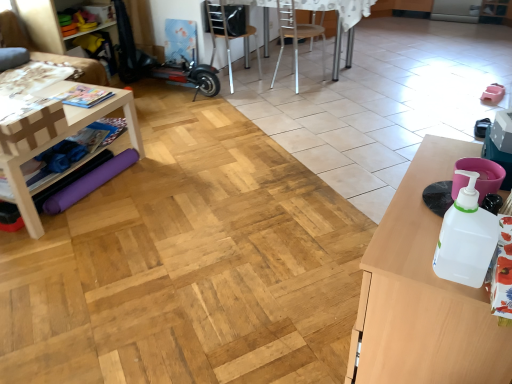
You are a GUI agent. You are given a task and a screenshot of the screen. Output one action in this format:
    pyautogui.click(x=<x>, y=<y>)
    Task: Click on the free space behind wooden table at right, which is the 2th table in left-to-right order
    The width and height of the screenshot is (512, 384).
    Given the screenshot: What is the action you would take?
    pyautogui.click(x=320, y=263)